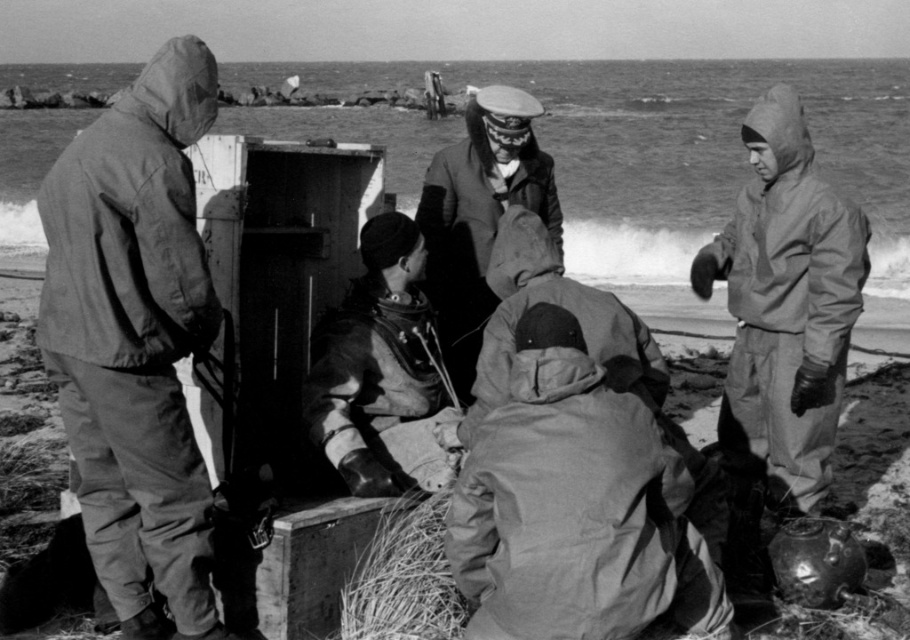
Which is more to the left, leather gloves at center or fuzzy straw at lower center?

leather gloves at center is more to the left.

Describe the element at coordinates (381, 371) in the screenshot. I see `leather gloves at center` at that location.

In order to click on leather gloves at center in this screenshot , I will do `click(381, 371)`.

Does matte gray jacket at left appear under matte gray jumpsuit at right?

No.

Is the position of matte gray jacket at left more distant than that of matte gray jumpsuit at right?

No, matte gray jacket at left is in front of matte gray jumpsuit at right.

The width and height of the screenshot is (910, 640). What do you see at coordinates (135, 339) in the screenshot? I see `matte gray jacket at left` at bounding box center [135, 339].

This screenshot has height=640, width=910. Identify the location of matte gray jacket at left. (135, 339).

The width and height of the screenshot is (910, 640). What do you see at coordinates (782, 324) in the screenshot?
I see `matte gray jumpsuit at right` at bounding box center [782, 324].

Does point (807, 324) come closer to viewer compared to point (410, 513)?

That is False.

Identify the location of matte gray jumpsuit at right. The width and height of the screenshot is (910, 640). (782, 324).